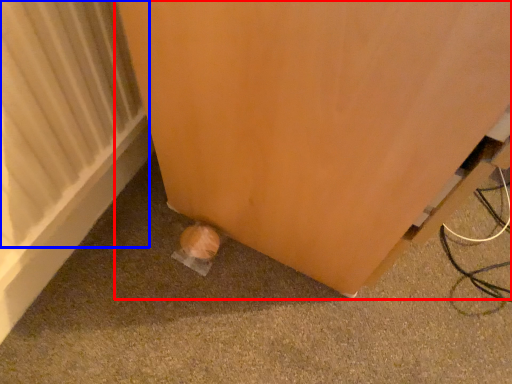
Question: Which point is closer to the camera, furniture (highlighted by a red box) or radiator (highlighted by a blue box)?

Choices:
 (A) furniture
 (B) radiator

Answer: (A)